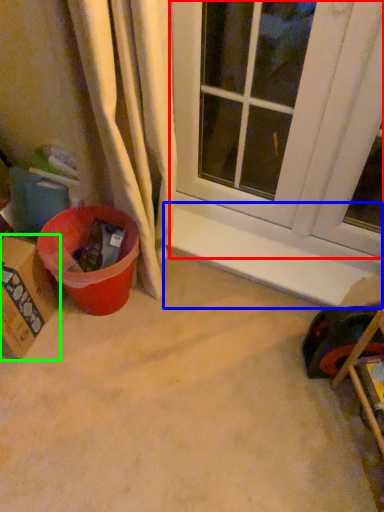
Question: Estimate the real-world distances between objects in this image. Which object is closer to window (highlighted by a red box), window sill (highlighted by a blue box) or cardboard box (highlighted by a green box)?

Choices:
 (A) window sill
 (B) cardboard box

Answer: (A)